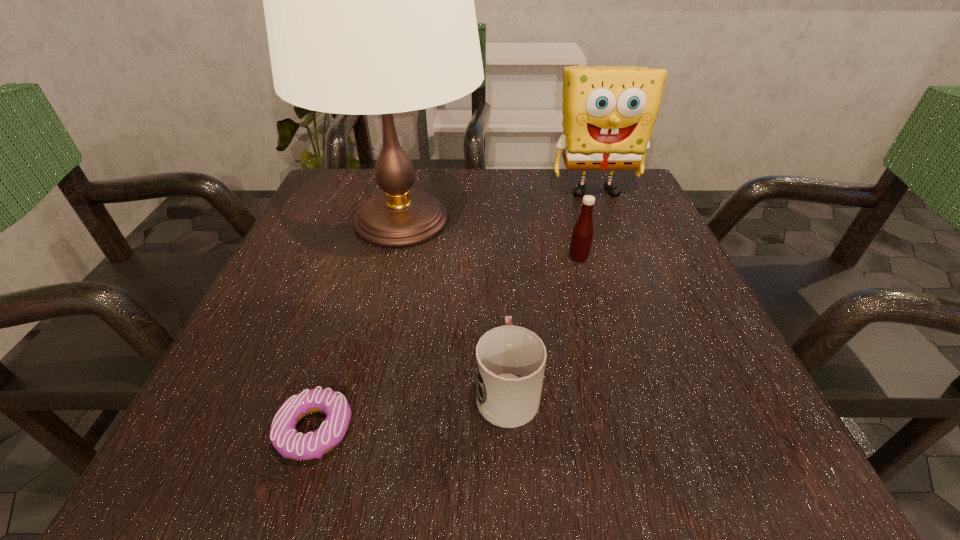
Find the location of a particular element. Image resolution: width=960 pixels, height=540 pixels. vacant region located 0.330m on the handle side of the cup is located at coordinates (498, 227).

Locate an element on the screen. blank space located on the back of the doughnut is located at coordinates (347, 327).

The height and width of the screenshot is (540, 960). I want to click on lamp positioned at the far edge, so tap(369, 6).

Find the location of a particular element. The image size is (960, 540). sponge that is at the far edge is located at coordinates (609, 112).

This screenshot has width=960, height=540. I want to click on cup at the near edge, so click(x=510, y=360).

Where is `doughnut located in the near edge section of the desktop`? Image resolution: width=960 pixels, height=540 pixels. doughnut located in the near edge section of the desktop is located at coordinates (285, 438).

Locate an element on the screen. This screenshot has height=540, width=960. lamp situated at the left edge is located at coordinates (369, 6).

Where is `doughnut at the left edge`? The image size is (960, 540). doughnut at the left edge is located at coordinates (285, 438).

At what (x,y) coordinates should I click in order to perform the action: click on object situated at the right edge. Please return your answer as a coordinate pair (x, y). The height and width of the screenshot is (540, 960). Looking at the image, I should click on (609, 112).

The image size is (960, 540). Find the location of `object located at the far left corner`. object located at the far left corner is located at coordinates (369, 6).